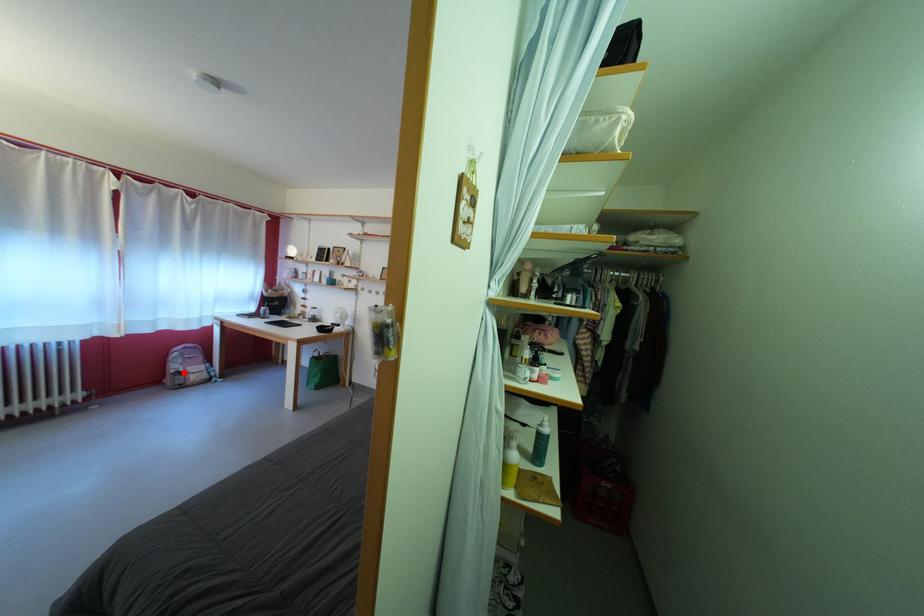
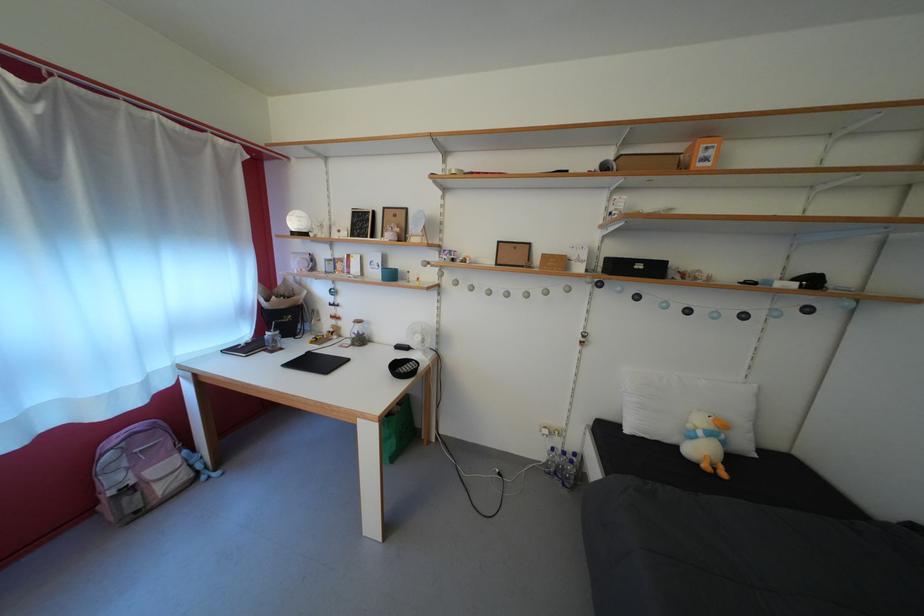
Question: A red point is marked in image1. In image2, is the corresponding 3D point closer to the camera or farther? Reply with the corresponding letter.

Choices:
 (A) The corresponding 3D point is closer.
 (B) The corresponding 3D point is farther.

Answer: (B)